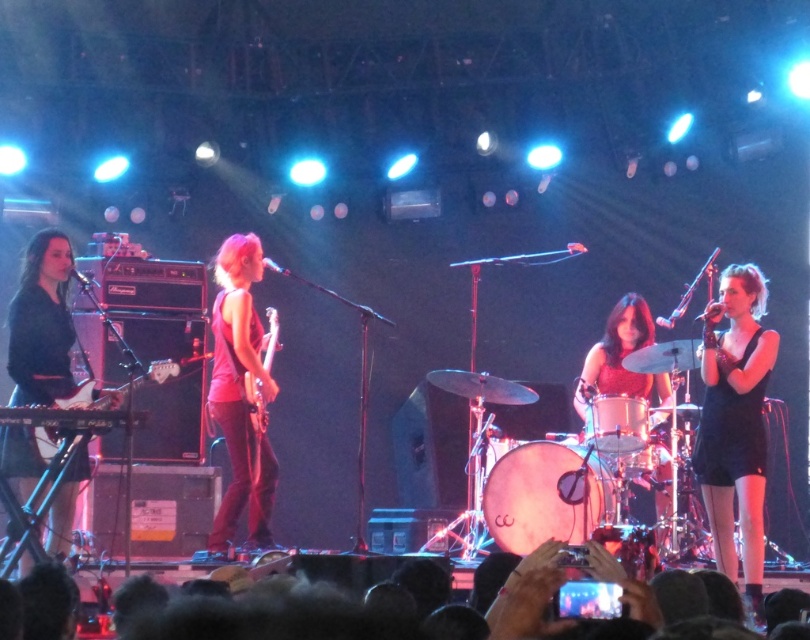
You are a photographer at the back of the venue and want to capture a clear photo of both the black matte dress at right and the matte black keyboardist at left. Which one will appear larger in your photo?

The black matte dress at right will appear larger in the photo because it is closer to the viewer than the matte black keyboardist at left.

From the picture: You are a photographer at the back of the venue and want to capture a clear shot of the matte black keyboardist at left without the black fabric crowd at lower center blocking the view. Based on their positions, is this possible?

The black fabric crowd at lower center is to the right of the matte black keyboardist at left, so positioning yourself to the left side of the stage would allow you to capture the matte black keyboardist at left without obstruction from the crowd.

You are a photographer at the back of the venue trying to capture the band members. There are two points of interest marked on your camera screen. The first is point 1 at coordinates point (x=651, y=588) and the second is point 2 at coordinates point (x=53, y=342). Which point should you focus on to get a clearer image?

Point (x=651, y=588) is closer to the viewer than point (x=53, y=342), so focusing on point (x=651, y=588) will result in a clearer image.